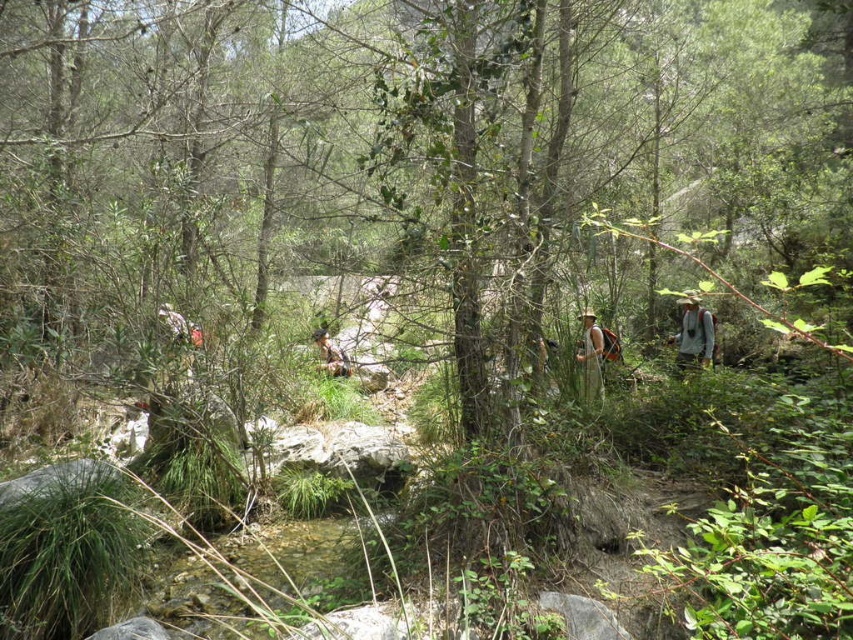
You are standing at the edge of the stream in the forest scene. You notice two points marked on the ground ahead of you. The first point is at coordinates point (x=693, y=326) and the second is at point (x=595, y=384). Which point is closer to you?

Point (x=693, y=326) is closer to you because it is further to the viewer than point (x=595, y=384).

You are a hiker who just arrived at the stream in the forest. You see a white fabric dress at center and a brown leather backpack at center. Which item is located to the right of the other?

The white fabric dress at center is positioned on the right side of brown leather backpack at center, so the dress is to the right of the backpack.